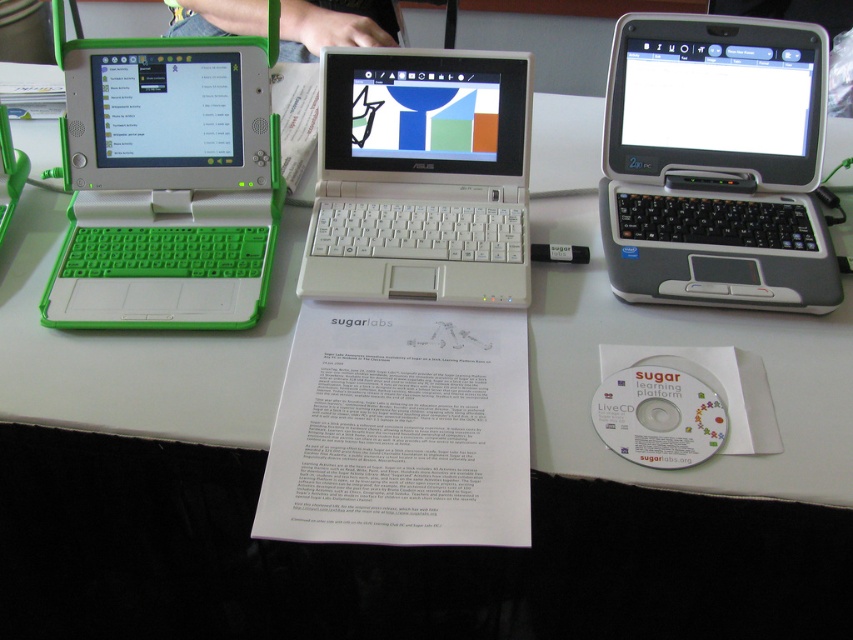
Question: Based on their relative distances, which object is farther from the white paper at center?

Choices:
 (A) green fabric pants at upper center
 (B) green matte laptop at left

Answer: (A)

Question: Is green matte laptop at left to the left of green fabric pants at upper center from the viewer's perspective?

Choices:
 (A) no
 (B) yes

Answer: (B)

Question: Can you confirm if green matte laptop at left is positioned to the right of white plastic laptop at center?

Choices:
 (A) yes
 (B) no

Answer: (B)

Question: Which of these objects is positioned closest to the green fabric pants at upper center?

Choices:
 (A) white plastic laptop at center
 (B) green matte laptop at left
 (C) gray matte laptop at upper right

Answer: (B)

Question: Which is farther from the green fabric pants at upper center?

Choices:
 (A) white plastic laptop at center
 (B) white paper at center
 (C) green matte laptop at left
 (D) gray matte laptop at upper right

Answer: (D)

Question: Does green matte laptop at left have a larger size compared to green fabric pants at upper center?

Choices:
 (A) yes
 (B) no

Answer: (B)